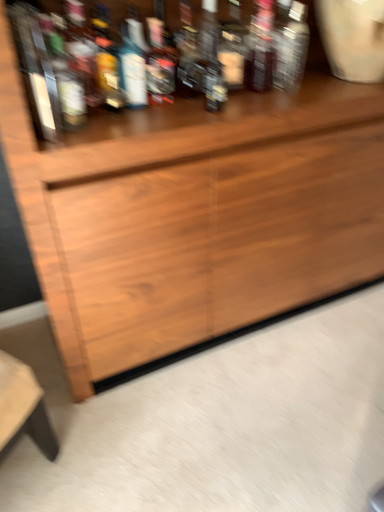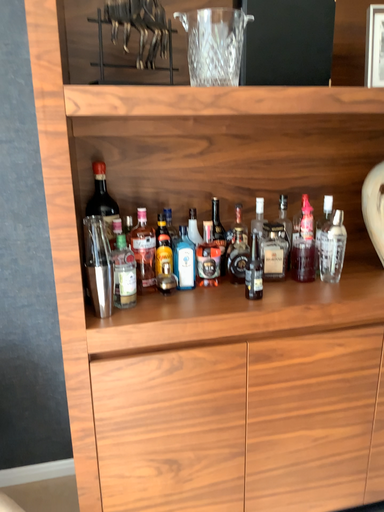
Question: Which way did the camera rotate in the video?

Choices:
 (A) rotated left
 (B) rotated right

Answer: (A)